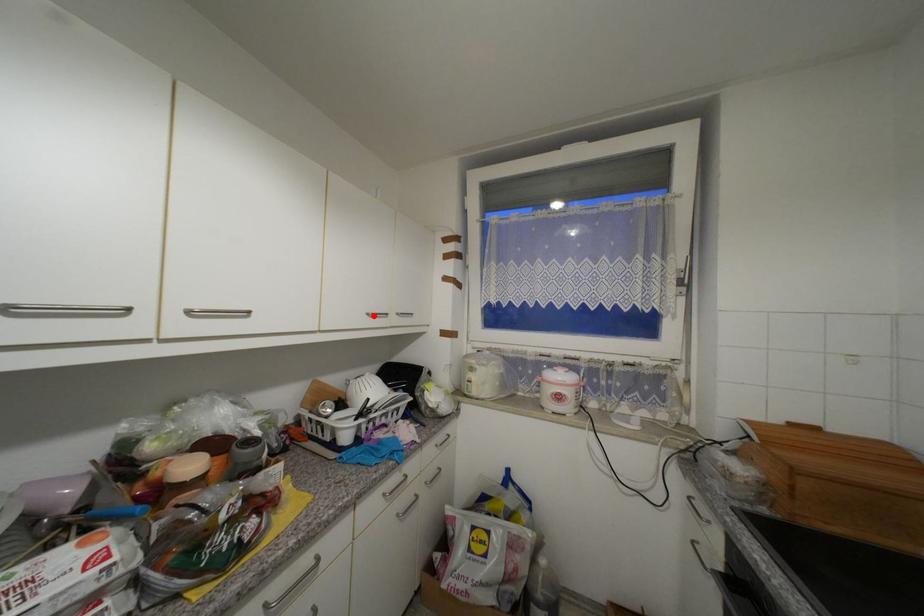
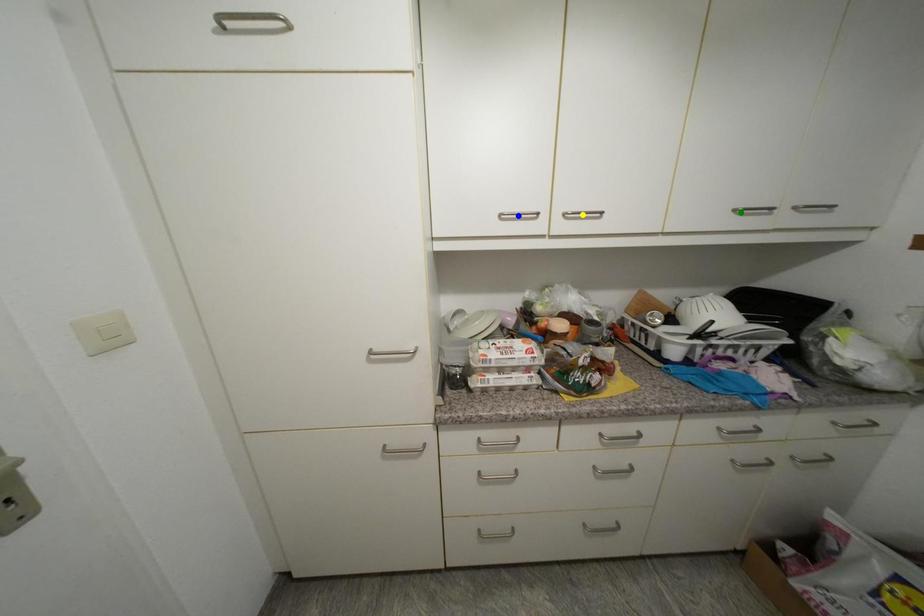
Question: I am providing you with two images of the same scene from different viewpoints. A red point is marked on the first image. You are given multiple points on the second image. In image 2, which mark is for the same physical point as the one in image 1?

Choices:
 (A) blue point
 (B) green point
 (C) yellow point

Answer: (B)